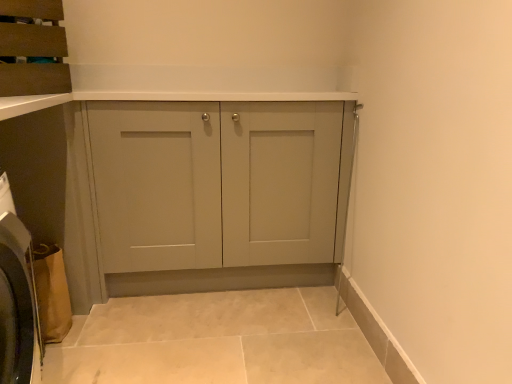
Question: Is matte brown cabinet at upper left not within matte gray cabinet at center?

Choices:
 (A) no
 (B) yes

Answer: (B)

Question: Is matte gray cabinet at center a part of matte brown cabinet at upper left?

Choices:
 (A) no
 (B) yes

Answer: (A)

Question: From a real-world perspective, does matte brown cabinet at upper left stand above matte gray cabinet at center?

Choices:
 (A) yes
 (B) no

Answer: (A)

Question: Is matte brown cabinet at upper left positioned in front of matte gray cabinet at center?

Choices:
 (A) yes
 (B) no

Answer: (A)

Question: From a real-world perspective, is matte brown cabinet at upper left below matte gray cabinet at center?

Choices:
 (A) yes
 (B) no

Answer: (B)

Question: From the image's perspective, is matte brown cabinet at upper left positioned above or below matte gray cabinet at center?

Choices:
 (A) below
 (B) above

Answer: (B)

Question: Would you say matte brown cabinet at upper left is inside or outside matte gray cabinet at center?

Choices:
 (A) inside
 (B) outside

Answer: (B)

Question: In terms of width, does matte brown cabinet at upper left look wider or thinner when compared to matte gray cabinet at center?

Choices:
 (A) wide
 (B) thin

Answer: (A)

Question: Considering the positions of matte brown cabinet at upper left and matte gray cabinet at center in the image, is matte brown cabinet at upper left taller or shorter than matte gray cabinet at center?

Choices:
 (A) short
 (B) tall

Answer: (A)

Question: Visually, is brown fabric washing machine at lower left positioned to the left or to the right of matte gray cabinet at center?

Choices:
 (A) right
 (B) left

Answer: (B)

Question: Is brown fabric washing machine at lower left in front of or behind matte gray cabinet at center in the image?

Choices:
 (A) behind
 (B) front

Answer: (B)

Question: Is brown fabric washing machine at lower left taller or shorter than matte gray cabinet at center?

Choices:
 (A) tall
 (B) short

Answer: (B)

Question: Considering the positions of brown fabric washing machine at lower left and matte gray cabinet at center in the image, is brown fabric washing machine at lower left wider or thinner than matte gray cabinet at center?

Choices:
 (A) wide
 (B) thin

Answer: (B)

Question: Is brown fabric washing machine at lower left to the left or to the right of matte brown cabinet at upper left in the image?

Choices:
 (A) left
 (B) right

Answer: (B)

Question: Is brown fabric washing machine at lower left spatially inside matte brown cabinet at upper left, or outside of it?

Choices:
 (A) inside
 (B) outside

Answer: (B)